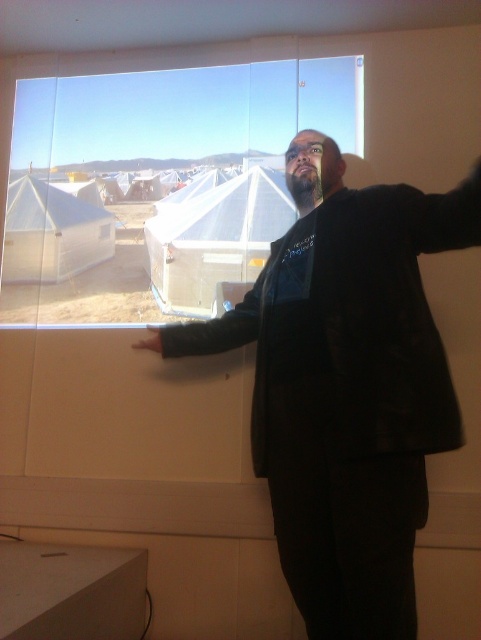
You are an attendee at the presentation and notice the black leather jacket at upper right and the transparent glass window at upper center. Which object is nearer to you in the image?

The black leather jacket at upper right is closer to the viewer than the transparent glass window at upper center.